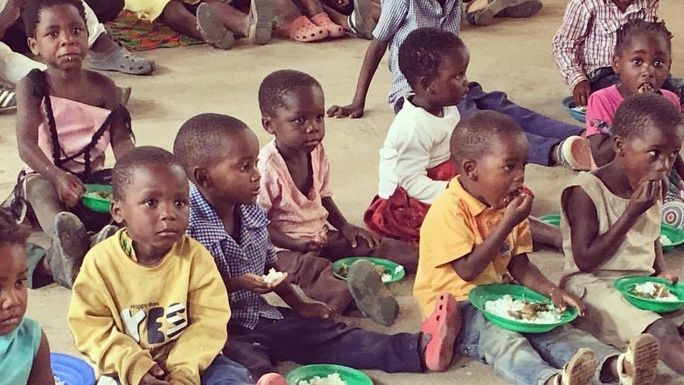
Identify the location of towel. (154, 36).